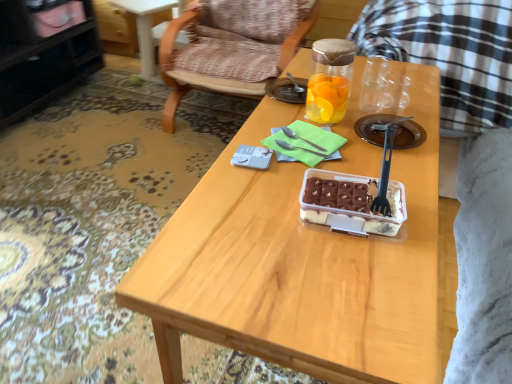
In order to click on free location to the right of black plastic fork at center, the 3th fork when ordered from back to front in this screenshot , I will do `click(421, 188)`.